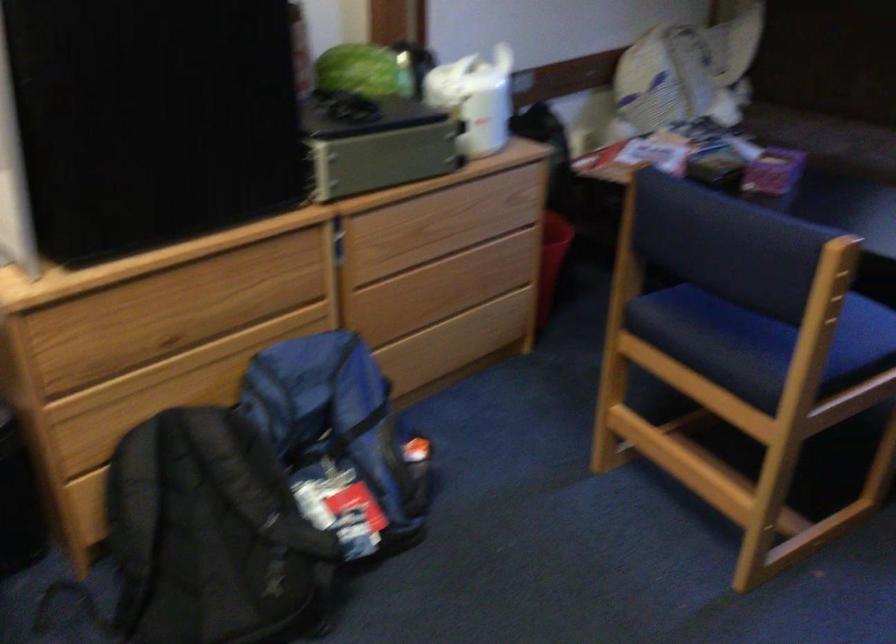
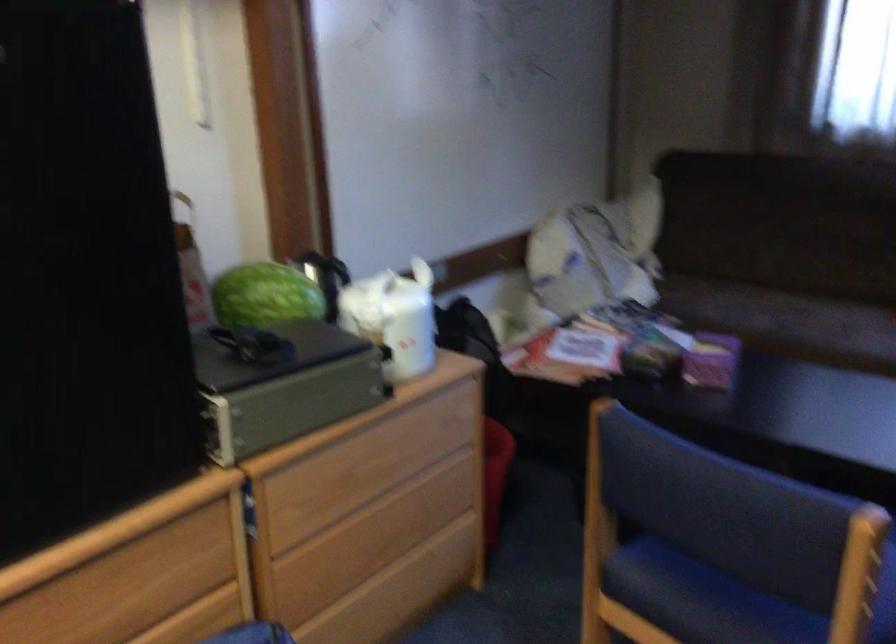
Question: The first image is from the beginning of the video and the second image is from the end. How did the camera likely rotate when shooting the video?

Choices:
 (A) Left
 (B) Right
 (C) Up
 (D) Down

Answer: (C)